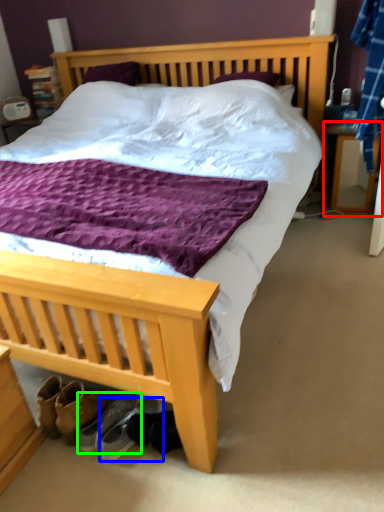
Question: Which object is positioned farthest from nightstand (highlighted by a red box)? Select from footwear (highlighted by a blue box) and footwear (highlighted by a green box).

Choices:
 (A) footwear
 (B) footwear

Answer: (B)